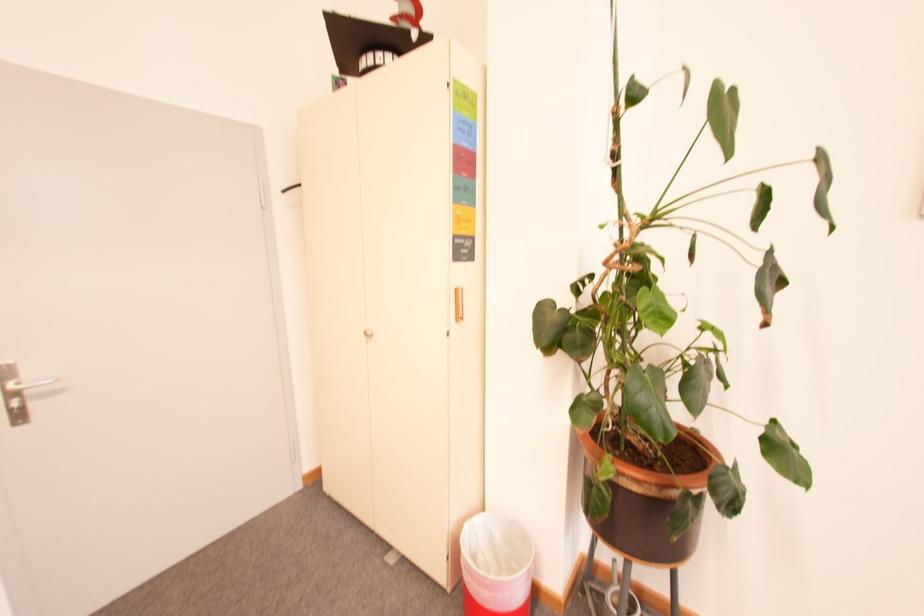
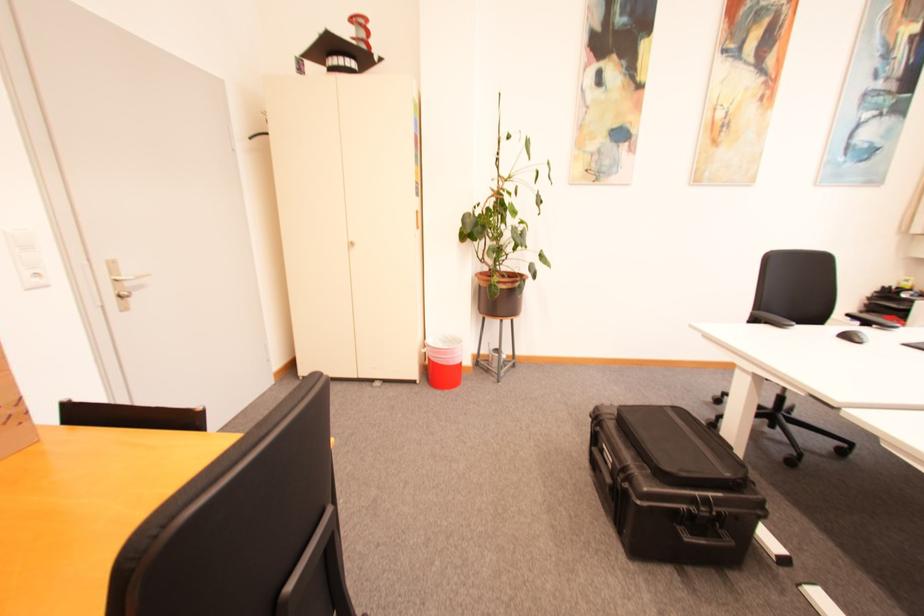
Locate, in the second image, the point that corresponds to point (601, 488) in the first image.

(500, 286)